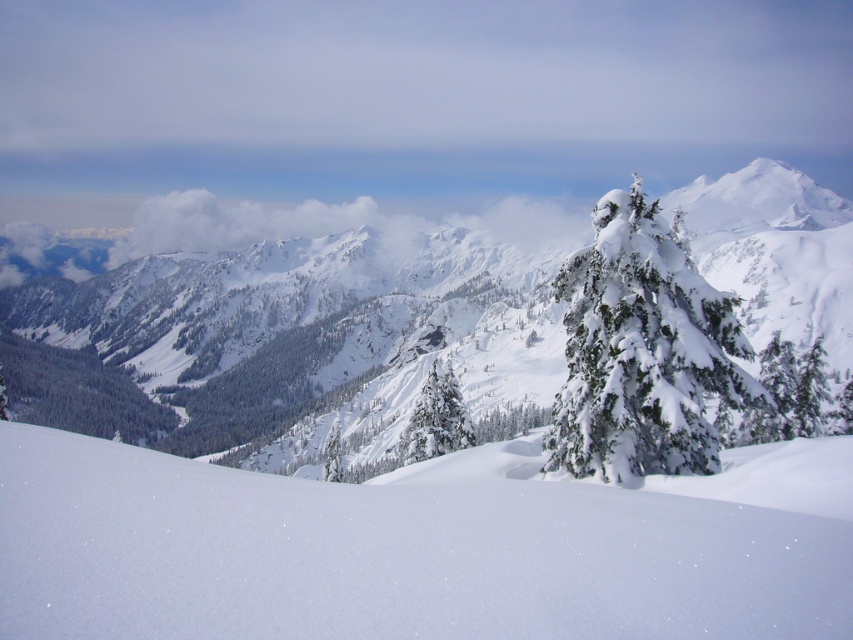
Is white snow at center above green textured evergreen tree at center?

No, white snow at center is not above green textured evergreen tree at center.

Consider the image. Is white snow at center shorter than green textured evergreen tree at center?

Correct, white snow at center is not as tall as green textured evergreen tree at center.

Is point (676, 506) more distant than point (628, 266)?

No, (676, 506) is closer to viewer.

Image resolution: width=853 pixels, height=640 pixels. Identify the location of white snow at center. (390, 556).

Between point (834, 352) and point (128, 474), which one is positioned in front?

Point (128, 474)

Does white snow-covered mountain at center have a lesser height compared to white snow at center?

Incorrect, white snow-covered mountain at center's height does not fall short of white snow at center's.

The height and width of the screenshot is (640, 853). Identify the location of white snow-covered mountain at center. (289, 348).

Does white snow at center come behind green matte tree at center?

That is False.

Find the location of `white snow at center`. white snow at center is located at coordinates (390, 556).